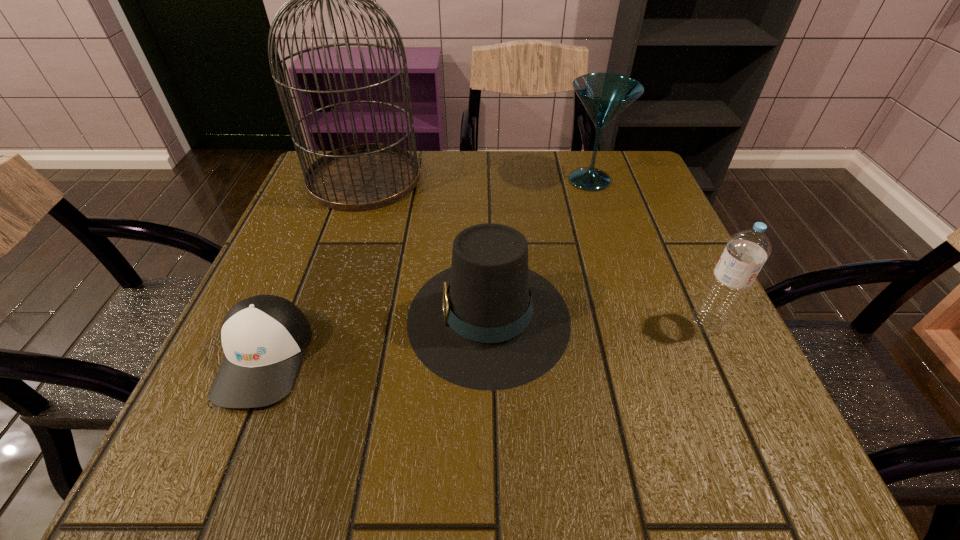
I want to click on the tallest object, so click(361, 177).

I want to click on the fourth object from left to right, so click(604, 95).

This screenshot has height=540, width=960. In order to click on water bottle in this screenshot , I will do `click(746, 251)`.

Where is `hat`? hat is located at coordinates (488, 322).

Where is `the third object from left to right`? The height and width of the screenshot is (540, 960). the third object from left to right is located at coordinates (488, 322).

Identify the location of cap. (264, 337).

Find the location of a particular element. Image resolution: width=960 pixels, height=540 pixels. free space located 0.400m on the front of the birdcage is located at coordinates (302, 363).

Image resolution: width=960 pixels, height=540 pixels. Identify the location of vacant space located on the left of the martini. (493, 180).

I want to click on vacant space located on the left of the water bottle, so click(650, 322).

Where is `blank space located 0.270m on the front-facing side of the fourth tallest object`? Image resolution: width=960 pixels, height=540 pixels. blank space located 0.270m on the front-facing side of the fourth tallest object is located at coordinates (252, 317).